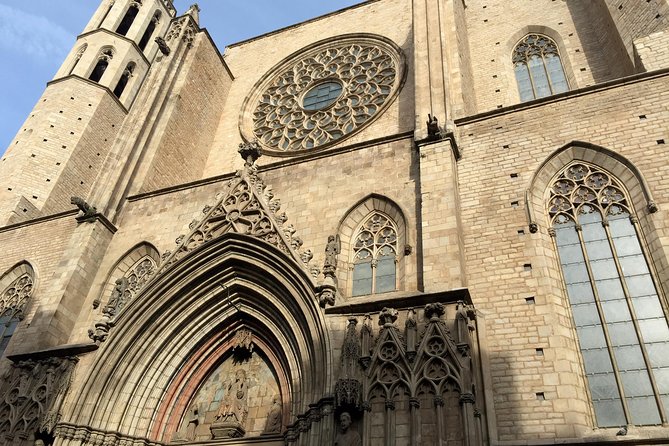
Identify the location of top points arched windows. (373, 203), (572, 152), (527, 30), (144, 251), (21, 270).